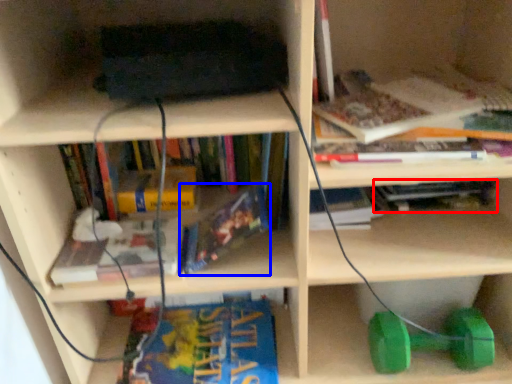
Question: Which object is further to the camera taking this photo, book (highlighted by a red box) or book (highlighted by a blue box)?

Choices:
 (A) book
 (B) book

Answer: (A)